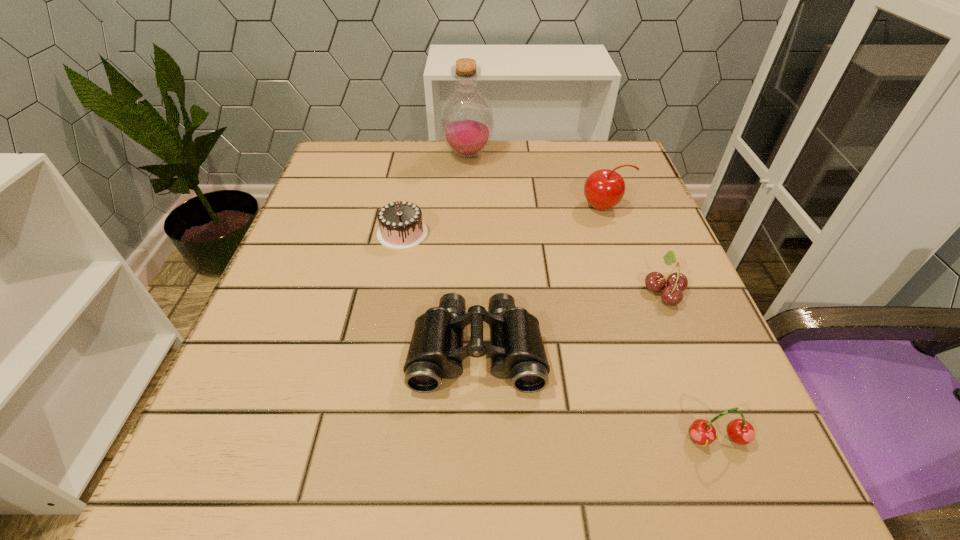
I want to click on free area in between the nearest object and the chocolate cake, so point(560,336).

This screenshot has height=540, width=960. In order to click on free spot between the second tallest object and the fifth farthest object in this screenshot , I will do `click(540, 278)`.

Where is `free space that is in between the fourth farthest object and the nearest object`? The width and height of the screenshot is (960, 540). free space that is in between the fourth farthest object and the nearest object is located at coordinates (690, 365).

You are a GUI agent. You are given a task and a screenshot of the screen. Output one action in this format:
    pyautogui.click(x=<x>, y=<y>)
    Task: Click on the object that is the third closest to the second nearest cherry
    
    Given the screenshot: What is the action you would take?
    click(x=740, y=431)

Locate an element on the screen. object that stands as the fourth closest to the nearest cherry is located at coordinates (401, 227).

The image size is (960, 540). Find the location of `cherry that can be found as the second closest to the farthest object`. cherry that can be found as the second closest to the farthest object is located at coordinates (676, 283).

This screenshot has height=540, width=960. What are the coordinates of `cherry that is the nearest to the second farthest cherry` in the screenshot? It's located at (603, 189).

You are a GUI agent. You are given a task and a screenshot of the screen. Output one action in this format:
    pyautogui.click(x=<x>, y=<y>)
    Task: Click on the vacant point that satisfies the following two spatial constraints: 1. on the leaves of the second nearest cherry; 2. with stems pointing upwards on the nearest object
    The height and width of the screenshot is (540, 960).
    Given the screenshot: What is the action you would take?
    pyautogui.click(x=724, y=439)

Where is `free spot that satisfies the following two spatial constraints: 1. on the leaves of the second farthest cherry; 2. on the front-facing side of the fifth farthest object`? This screenshot has width=960, height=540. free spot that satisfies the following two spatial constraints: 1. on the leaves of the second farthest cherry; 2. on the front-facing side of the fifth farthest object is located at coordinates (687, 350).

Identify the location of vacant area in the image that satisfies the following two spatial constraints: 1. on the leaves of the second nearest cherry; 2. on the front-facing side of the second nearest object. (687, 350).